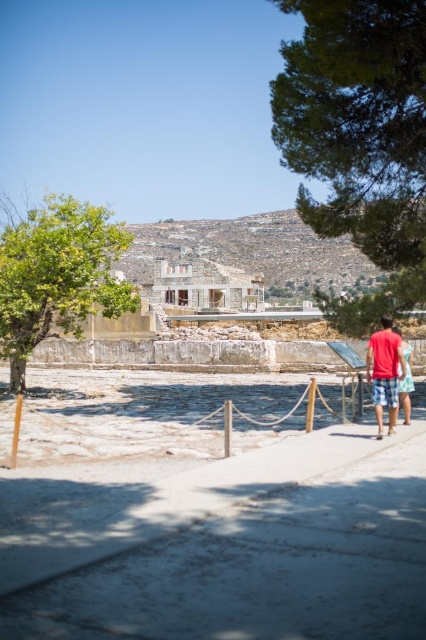
You are a tourist standing on the pathway at the archaeological site. You notice a green leafy tree at left and a red cotton shirt at right. Which object is closer to you?

The green leafy tree at left is closer to you because the red cotton shirt at right is behind it.

You are a visitor at the archaeological site and want to take a photo of both the green leafy tree at left and the red cotton shirt at right. Which object should you frame first in your camera to ensure both fit in the shot?

You should frame the green leafy tree at left first because its width is larger than the red cotton shirt at right, so starting with the wider object ensures both fit in the frame.